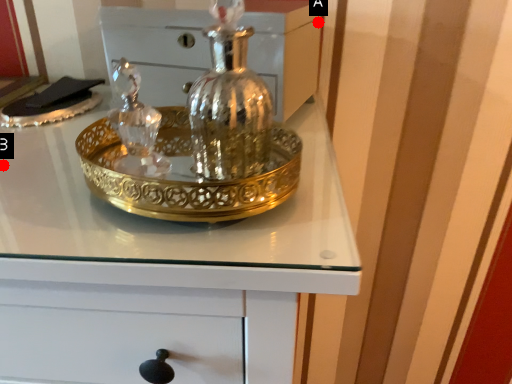
Question: Two points are circled on the image, labeled by A and B beside each circle. Which point is farther to the camera?

Choices:
 (A) A is further
 (B) B is further

Answer: (A)